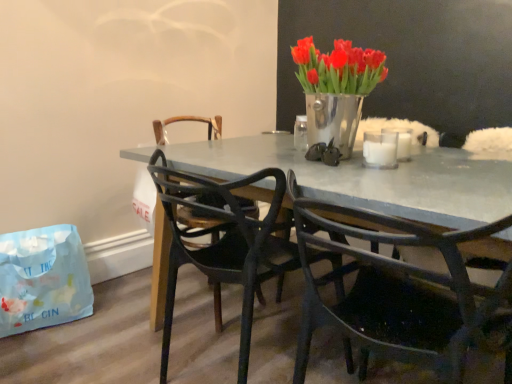
This screenshot has height=384, width=512. I want to click on vacant point to the right of light blue paper bag at lower left, so click(119, 325).